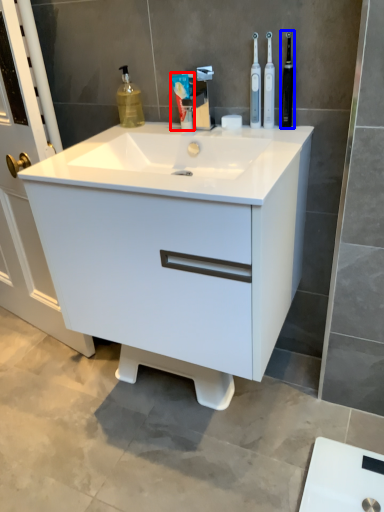
Question: Which of the following is the closest to the observer, toothpaste (highlighted by a red box) or toiletry (highlighted by a blue box)?

Choices:
 (A) toothpaste
 (B) toiletry

Answer: (B)